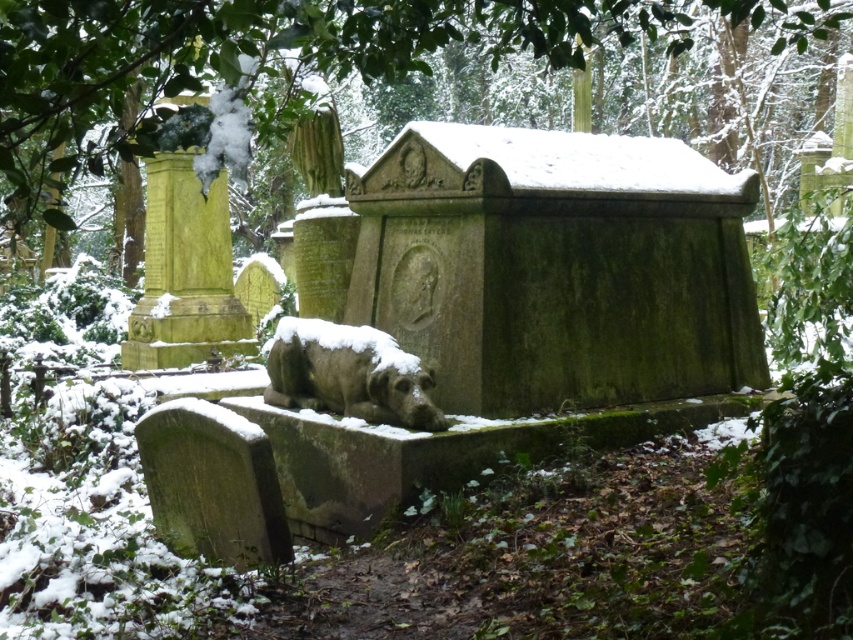
Question: Is green mossy tree at upper center wider than slate gray stone dog at center?

Choices:
 (A) no
 (B) yes

Answer: (B)

Question: Which point is closer to the camera?

Choices:
 (A) (12, 131)
 (B) (361, 349)

Answer: (A)

Question: Does green mossy tree at upper center have a greater width compared to slate gray stone dog at center?

Choices:
 (A) yes
 (B) no

Answer: (A)

Question: Which of the following is the farthest from the observer?

Choices:
 (A) coord(292,326)
 (B) coord(521,29)

Answer: (A)

Question: Which object appears farthest from the camera in this image?

Choices:
 (A) green mossy tree at upper center
 (B) slate gray stone dog at center

Answer: (B)

Question: Is green mossy tree at upper center to the right of slate gray stone dog at center from the viewer's perspective?

Choices:
 (A) no
 (B) yes

Answer: (A)